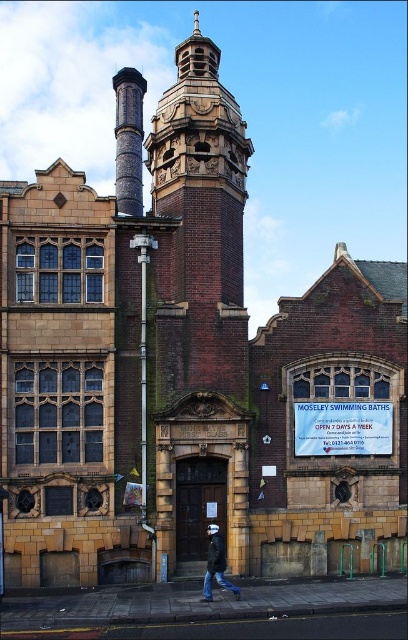
You are standing in front of the historic building and notice the rustic stone chimney at upper center and the dark blue jeans at lower center. From your vantage point, which object is closer to you?

The rustic stone chimney at upper center is closer to you because the dark blue jeans at lower center is behind it.

You are an architect examining the building and need to install a new decorative element. The rustic stone chimney at upper center and the dark blue jeans at lower center are both potential locations. Considering their sizes, which object would be more suitable for a larger decorative addition?

The rustic stone chimney at upper center is larger in size than the dark blue jeans at lower center, so it would be more suitable for a larger decorative addition.